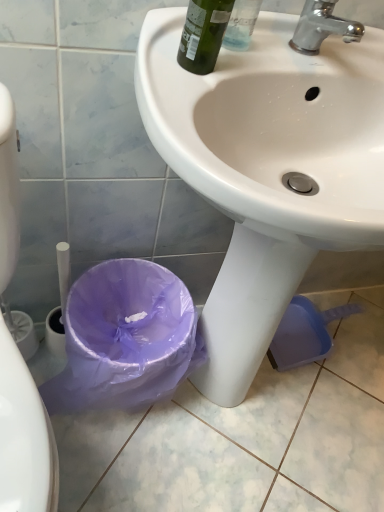
Question: Does white glossy sink at center lie behind chrome metallic faucet at upper right?

Choices:
 (A) no
 (B) yes

Answer: (A)

Question: Is white glossy sink at center next to chrome metallic faucet at upper right?

Choices:
 (A) yes
 (B) no

Answer: (B)

Question: Is white glossy sink at center aimed at chrome metallic faucet at upper right?

Choices:
 (A) yes
 (B) no

Answer: (B)

Question: From a real-world perspective, is white glossy sink at center below chrome metallic faucet at upper right?

Choices:
 (A) yes
 (B) no

Answer: (A)

Question: From the image's perspective, is white glossy sink at center over chrome metallic faucet at upper right?

Choices:
 (A) yes
 (B) no

Answer: (B)

Question: Would you say green glass bottle at upper center is to the left or to the right of white glossy sink at center in the picture?

Choices:
 (A) right
 (B) left

Answer: (B)

Question: From the image's perspective, relative to white glossy sink at center, is green glass bottle at upper center above or below?

Choices:
 (A) below
 (B) above

Answer: (B)

Question: Choose the correct answer: Is green glass bottle at upper center inside white glossy sink at center or outside it?

Choices:
 (A) inside
 (B) outside

Answer: (B)

Question: Looking at the image, does green glass bottle at upper center seem bigger or smaller compared to white glossy sink at center?

Choices:
 (A) small
 (B) big

Answer: (A)

Question: Is chrome metallic faucet at upper right taller or shorter than purple plastic bag at lower left?

Choices:
 (A) tall
 (B) short

Answer: (B)

Question: Considering the positions of chrome metallic faucet at upper right and purple plastic bag at lower left in the image, is chrome metallic faucet at upper right wider or thinner than purple plastic bag at lower left?

Choices:
 (A) wide
 (B) thin

Answer: (B)

Question: From a real-world perspective, relative to purple plastic bag at lower left, is chrome metallic faucet at upper right vertically above or below?

Choices:
 (A) below
 (B) above

Answer: (B)

Question: From the image's perspective, is chrome metallic faucet at upper right above or below purple plastic bag at lower left?

Choices:
 (A) above
 (B) below

Answer: (A)

Question: Is chrome metallic faucet at upper right inside or outside of white glossy sink at center?

Choices:
 (A) inside
 (B) outside

Answer: (B)

Question: In the image, is chrome metallic faucet at upper right on the left side or the right side of white glossy sink at center?

Choices:
 (A) left
 (B) right

Answer: (B)